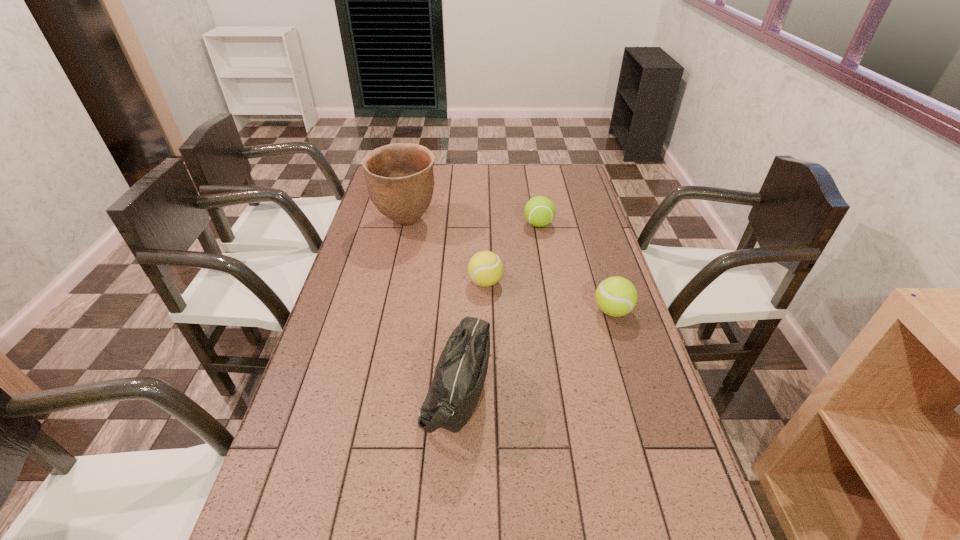
Identify the location of the tallest object. This screenshot has height=540, width=960. (399, 177).

The width and height of the screenshot is (960, 540). What are the coordinates of `the leftmost object` in the screenshot? It's located at (399, 177).

Locate an element on the screen. The height and width of the screenshot is (540, 960). the second tallest object is located at coordinates (460, 373).

Where is `the nearest object`? The width and height of the screenshot is (960, 540). the nearest object is located at coordinates (460, 373).

In order to click on the second nearest object in this screenshot , I will do `click(616, 296)`.

The image size is (960, 540). Find the location of `the rightmost object`. the rightmost object is located at coordinates (616, 296).

Identify the location of the second tennis ball from right to left. This screenshot has width=960, height=540. click(539, 211).

Image resolution: width=960 pixels, height=540 pixels. I want to click on the farthest tennis ball, so click(x=539, y=211).

Find the location of a particular element. the leftmost tennis ball is located at coordinates (485, 268).

The width and height of the screenshot is (960, 540). In order to click on the third nearest object in this screenshot , I will do `click(485, 268)`.